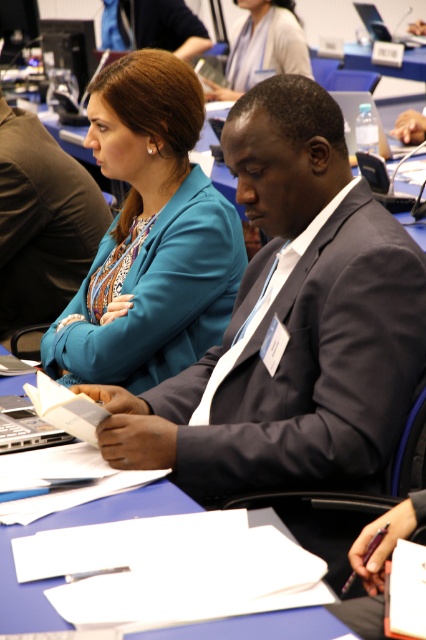
Question: Is matte black suit at center wider than matte blue blazer at upper center?

Choices:
 (A) no
 (B) yes

Answer: (A)

Question: Can you confirm if matte black suit at center is positioned to the right of matte blue blazer at upper center?

Choices:
 (A) yes
 (B) no

Answer: (B)

Question: Which point is closer to the camera taking this photo?

Choices:
 (A) click(80, 230)
 (B) click(259, 45)

Answer: (A)

Question: Is matte blue blazer at upper center positioned before silver metallic laptop at upper right?

Choices:
 (A) no
 (B) yes

Answer: (B)

Question: Estimate the real-world distances between objects in this image. Which object is farther from the silver metallic laptop at upper right?

Choices:
 (A) matte black suit at center
 (B) teal fabric jacket at upper center

Answer: (B)

Question: Which point appears closest to the camera in this image?

Choices:
 (A) (356, 6)
 (B) (281, 28)
 (C) (29, 136)

Answer: (C)